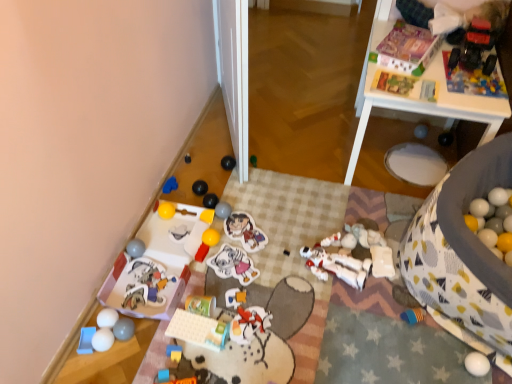
This screenshot has height=384, width=512. I want to click on vacant space that's between matte plastic sticker at center, the seventh toy when ordered from right to left, and white matte sticker at center, which is the nineteenth toy from left to right, so click(241, 254).